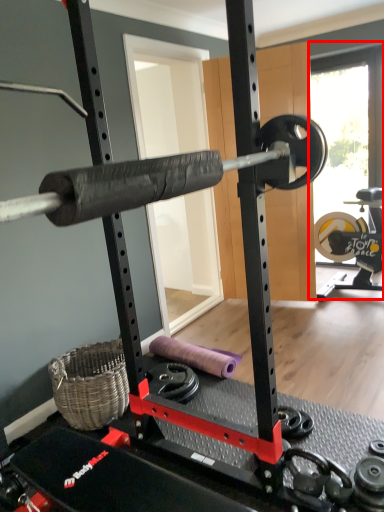
Question: From the image's perspective, what is the correct spatial relationship of window screen (annotated by the red box) in relation to dumbbell?

Choices:
 (A) above
 (B) below

Answer: (A)